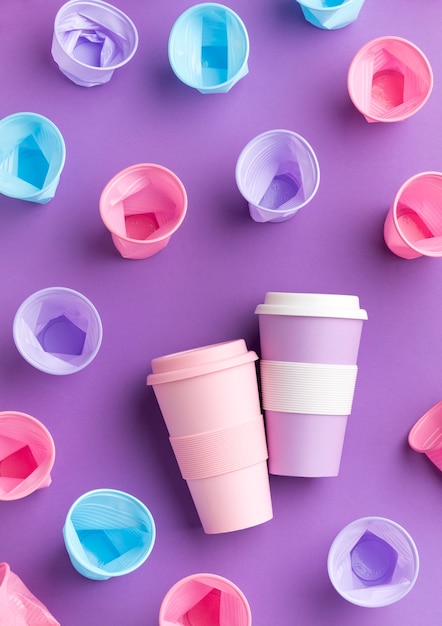
Locate an element on the screen. pink cups is located at coordinates (213, 413), (217, 602), (26, 602), (22, 448), (144, 211), (421, 218), (434, 433), (393, 81).